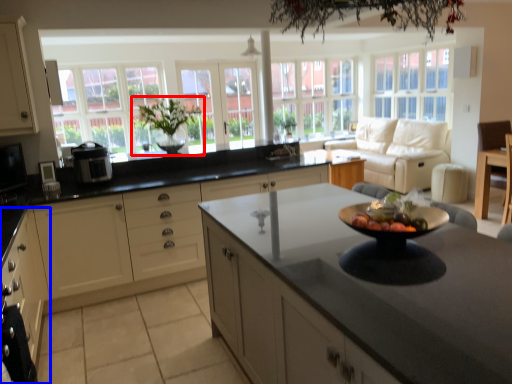
Question: Which object appears farthest to the camera in this image, houseplant (highlighted by a red box) or cabinetry (highlighted by a blue box)?

Choices:
 (A) houseplant
 (B) cabinetry

Answer: (A)